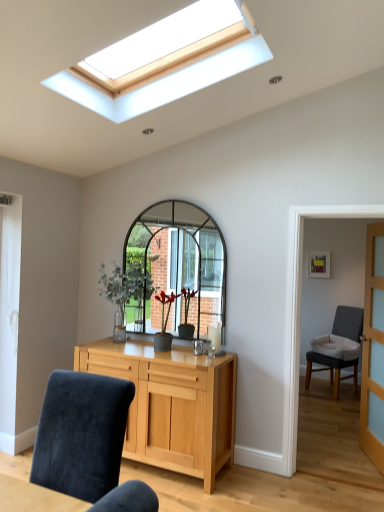
Find the location of `unoccupied area in front of green glass vase at center`. unoccupied area in front of green glass vase at center is located at coordinates (115, 348).